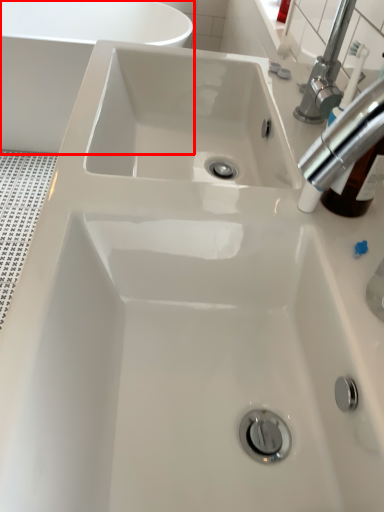
Question: In this image, where is bath (annotated by the red box) located relative to tap?

Choices:
 (A) right
 (B) left

Answer: (B)